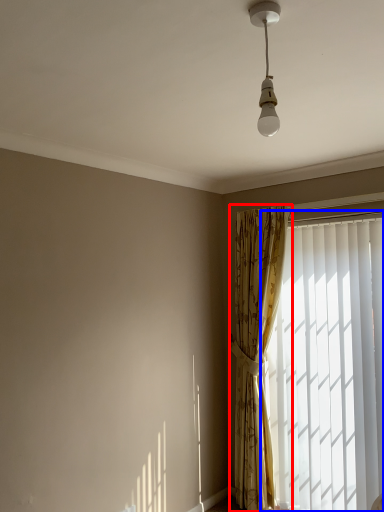
Question: Which object appears closest to the camera in this image, curtain (highlighted by a red box) or window (highlighted by a blue box)?

Choices:
 (A) curtain
 (B) window

Answer: (B)